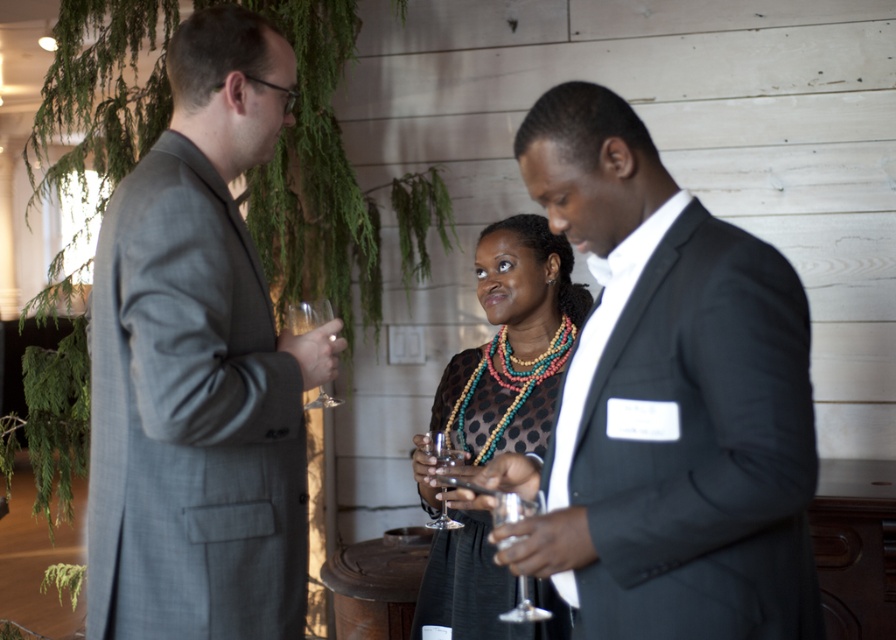
You are at a formal event and see the gray suit at left and the clear glass wine glass at lower center. Which object is positioned higher from the ground?

The gray suit at left is positioned higher from the ground than the clear glass wine wine glass at lower center.

You are at a formal event and see the gray suit at left and the clear glass wine glass at lower center. Which object is positioned more to the left?

The gray suit at left is positioned more to the left than the clear glass wine glass at lower center.

You are at the event and want to move to the point marked at coordinates (601, 554). If you are currently 2 meters away from this point, how much closer do you need to get to reach it?

The distance of point (601, 554) from viewer is 1.34 meters, so you need to move 0.658 meters closer to reach it.